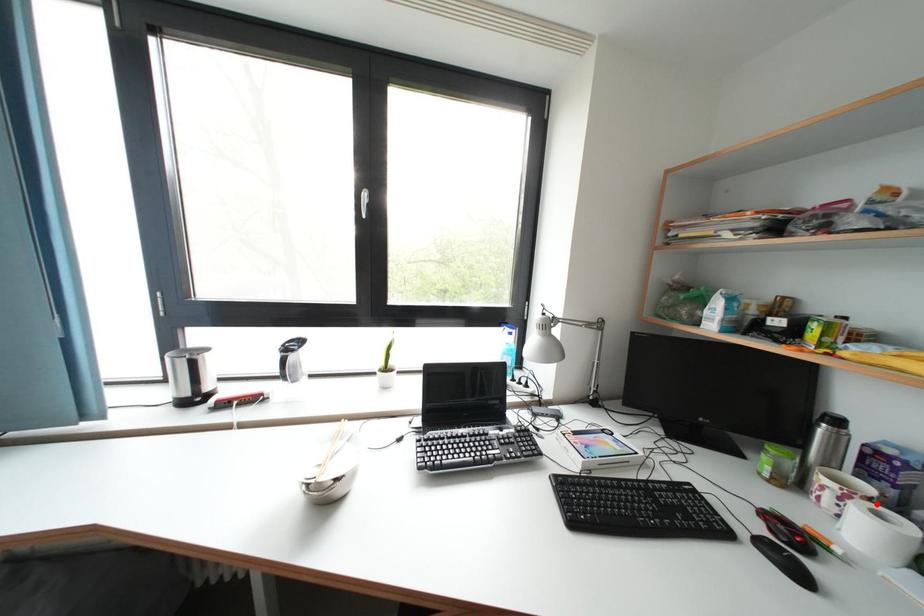
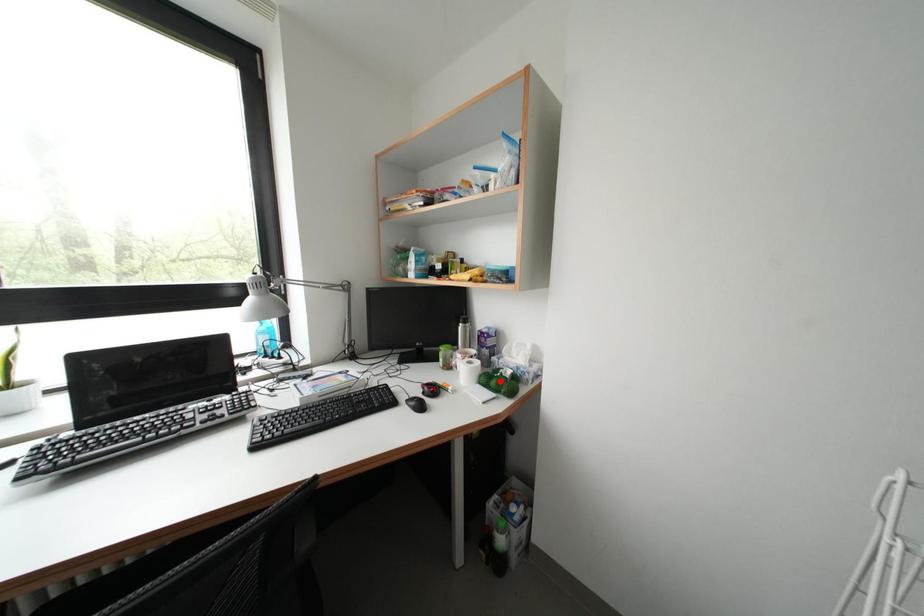
I am providing you with two images of the same scene from different viewpoints. A red point is marked on the first image and another point is marked on the second image. Is the red point in image1 aligned with the point shown in image2?

No